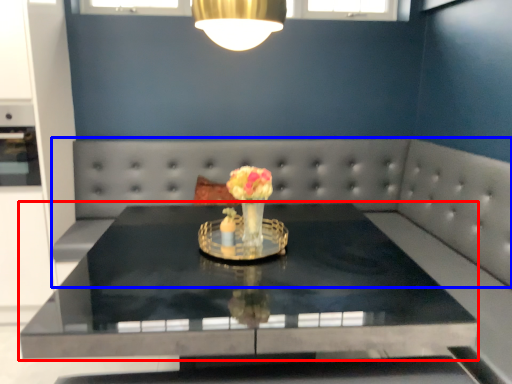
Question: Which object is further to the camera taking this photo, table (highlighted by a red box) or couch (highlighted by a blue box)?

Choices:
 (A) table
 (B) couch

Answer: (B)